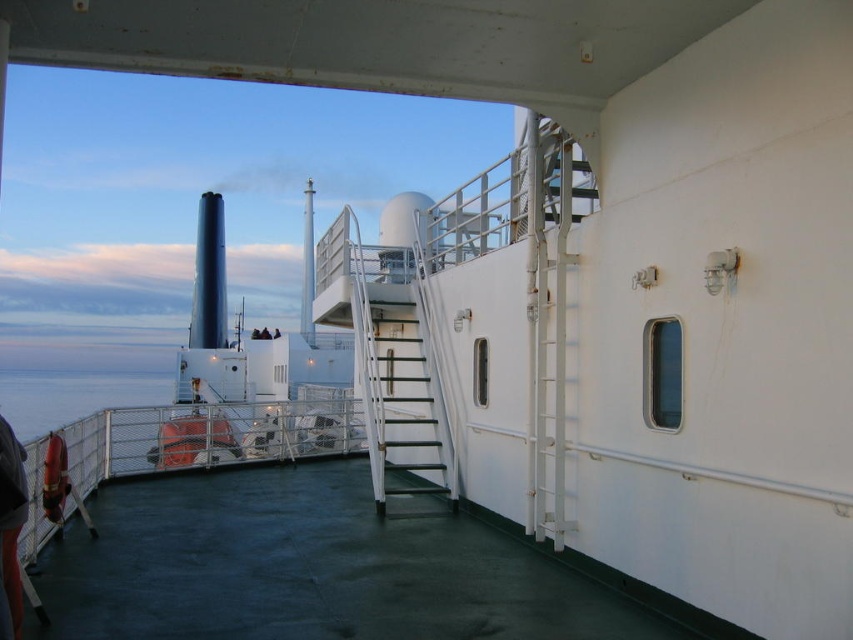
Question: Where is white metal staircase at center located in relation to rubber lifebuoy at lower left in the image?

Choices:
 (A) right
 (B) left

Answer: (A)

Question: Does blue water at lower left have a smaller size compared to rubber lifebuoy at lower left?

Choices:
 (A) yes
 (B) no

Answer: (B)

Question: Among these points, which one is nearest to the camera?

Choices:
 (A) (198, 572)
 (B) (18, 444)

Answer: (B)

Question: Among these points, which one is nearest to the camera?

Choices:
 (A) (19, 612)
 (B) (351, 282)
 (C) (20, 417)
 (D) (196, 486)

Answer: (A)

Question: Estimate the real-world distances between objects in this image. Which object is closer to the white metal staircase at center?

Choices:
 (A) white metal ladder at right
 (B) green rubber deck at center
 (C) blue water at lower left

Answer: (A)

Question: Does green rubber deck at center appear over blue water at lower left?

Choices:
 (A) yes
 (B) no

Answer: (A)